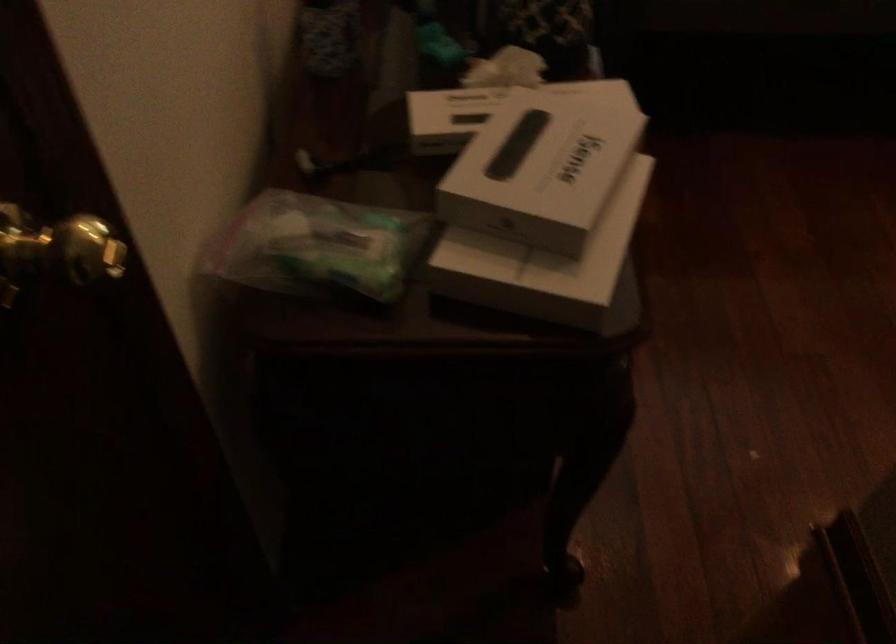
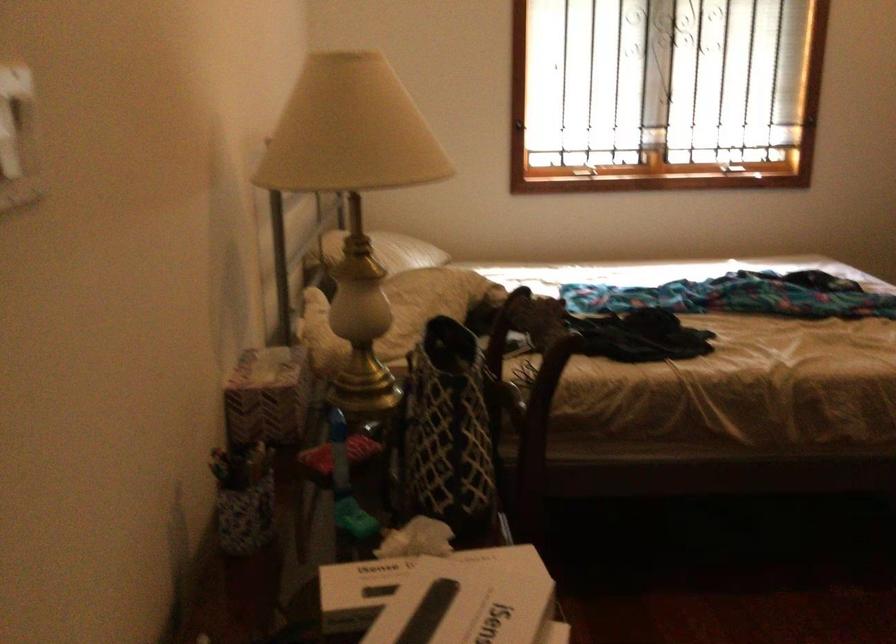
Question: Based on the continuous images, in which direction is the camera rotating? Reply with the corresponding letter.

Choices:
 (A) Left
 (B) Right
 (C) Up
 (D) Down

Answer: (C)